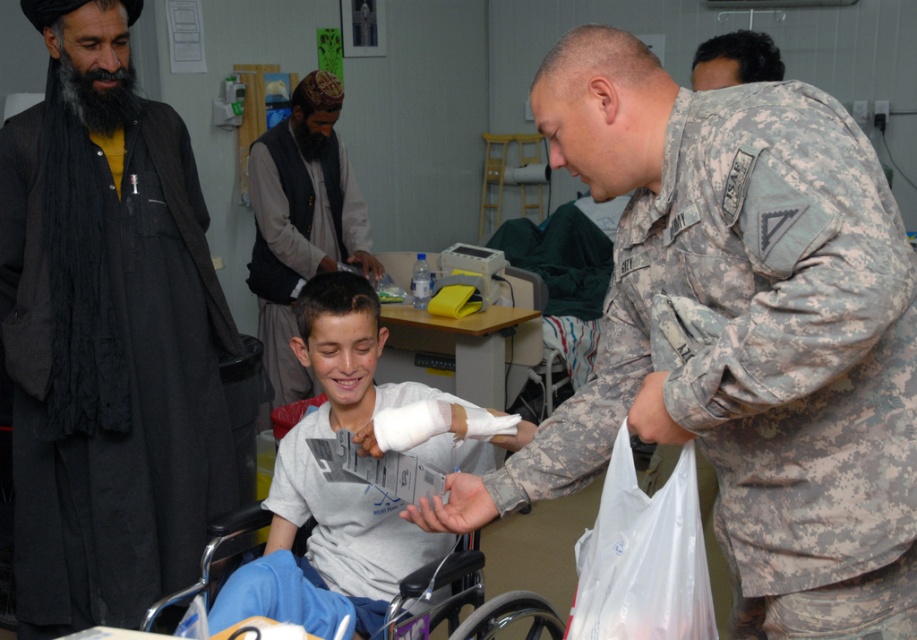
Which is in front, point (713, 157) or point (87, 476)?

Point (713, 157) is in front.

Who is lower down, camouflage fabric uniform at right or black matte robe at left?

Positioned lower is camouflage fabric uniform at right.

Does point (858, 424) lie behind point (32, 148)?

No.

Identify the location of camouflage fabric uniform at right. The height and width of the screenshot is (640, 917). (768, 356).

Who is positioned more to the left, black matte robe at left or gray woolen vest at center?

black matte robe at left is more to the left.

Does black matte robe at left come behind gray woolen vest at center?

No, black matte robe at left is in front of gray woolen vest at center.

Locate an element on the screen. The height and width of the screenshot is (640, 917). black matte robe at left is located at coordinates point(107,333).

Who is positioned more to the left, camouflage fabric uniform at right or white matte bandage at center?

From the viewer's perspective, white matte bandage at center appears more on the left side.

Which is behind, point (810, 593) or point (425, 397)?

The point (425, 397) is behind.

You are a GUI agent. You are given a task and a screenshot of the screen. Output one action in this format:
    pyautogui.click(x=<x>, y=<y>)
    Task: Click on the camouflage fabric uniform at right
    The width and height of the screenshot is (917, 640).
    Given the screenshot: What is the action you would take?
    pyautogui.click(x=768, y=356)